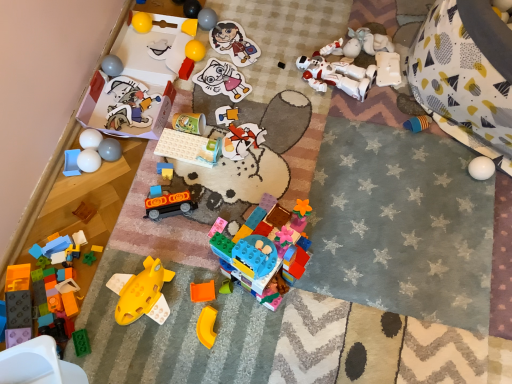
This screenshot has height=384, width=512. What are the coordinates of `empty space that is in between yellow rubber ball at upper center, the tenth toy from the right, and black plastic train at center, the 14th toy from the right` in the screenshot? It's located at (183, 144).